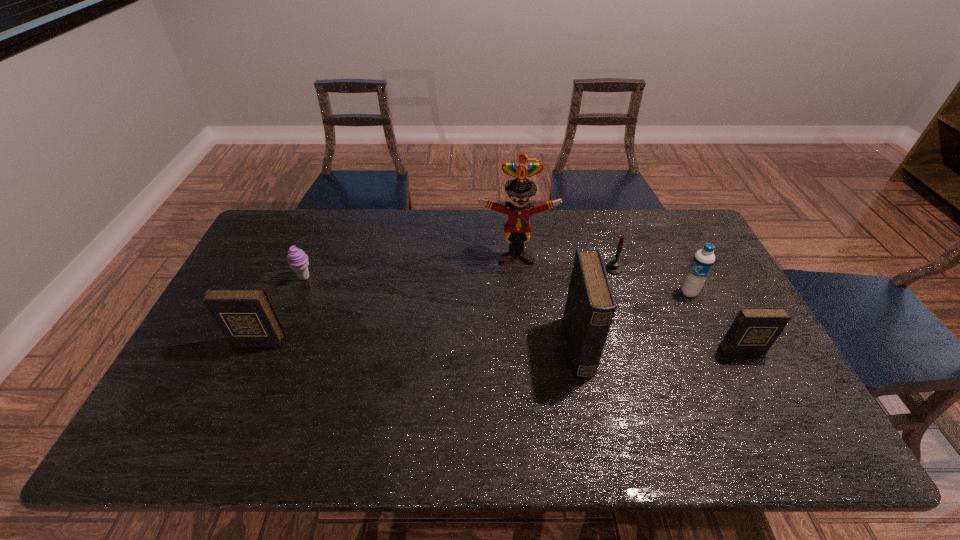
Locate an element on the screen. This screenshot has width=960, height=540. free spot located 0.080m on the front cover of the rightmost diary is located at coordinates (757, 380).

Find the location of a particular element. blank space located 0.270m on the front of the candle is located at coordinates (637, 343).

This screenshot has height=540, width=960. What are the coordinates of `vacant space located on the front-facing side of the nutcracker` in the screenshot? It's located at (518, 275).

Identify the location of vacant area located on the left of the icecream. (256, 278).

The image size is (960, 540). Find the location of `free location located 0.140m on the label of the fourth nearest object`. free location located 0.140m on the label of the fourth nearest object is located at coordinates (634, 292).

I want to click on vacant space located on the label of the fourth nearest object, so click(x=613, y=292).

The image size is (960, 540). Find the location of `free space located on the label of the fourth nearest object`. free space located on the label of the fourth nearest object is located at coordinates (597, 292).

The width and height of the screenshot is (960, 540). What are the coordinates of `object situated at the far edge` in the screenshot? It's located at (517, 230).

Where is `object present at the left edge`? The height and width of the screenshot is (540, 960). object present at the left edge is located at coordinates (246, 317).

Identify the location of diary that is positioned at the right edge. [x=754, y=330].